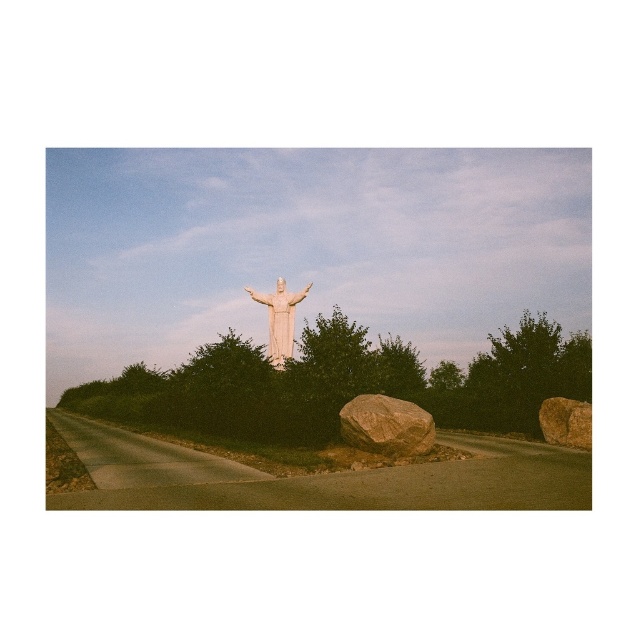
Is point (401, 413) positioned before point (590, 444)?

Yes, it is.

Is point (377, 394) positioned behind point (551, 442)?

That is False.

This screenshot has height=640, width=636. What do you see at coordinates (385, 426) in the screenshot?
I see `brown rough rock at lower center` at bounding box center [385, 426].

Where is `brown rough rock at lower center`? brown rough rock at lower center is located at coordinates click(385, 426).

Who is higher up, brown rough rock at lower center or white marble statue at center?

white marble statue at center

Is the position of brown rough rock at lower center more distant than that of white marble statue at center?

No, it is in front of white marble statue at center.

Between point (427, 445) and point (280, 353), which one is positioned in front?

Positioned in front is point (427, 445).

Image resolution: width=636 pixels, height=640 pixels. In order to click on brown rough rock at lower center in this screenshot , I will do `click(385, 426)`.

In the scene shown: Between brown rough rock at right and white marble statue at center, which one appears on the left side from the viewer's perspective?

Positioned to the left is white marble statue at center.

Is brown rough rock at right taller than white marble statue at center?

No.

You are a GUI agent. You are given a task and a screenshot of the screen. Output one action in this format:
    pyautogui.click(x=<x>, y=<y>)
    Task: Click on the brown rough rock at right
    
    Given the screenshot: What is the action you would take?
    pyautogui.click(x=565, y=422)